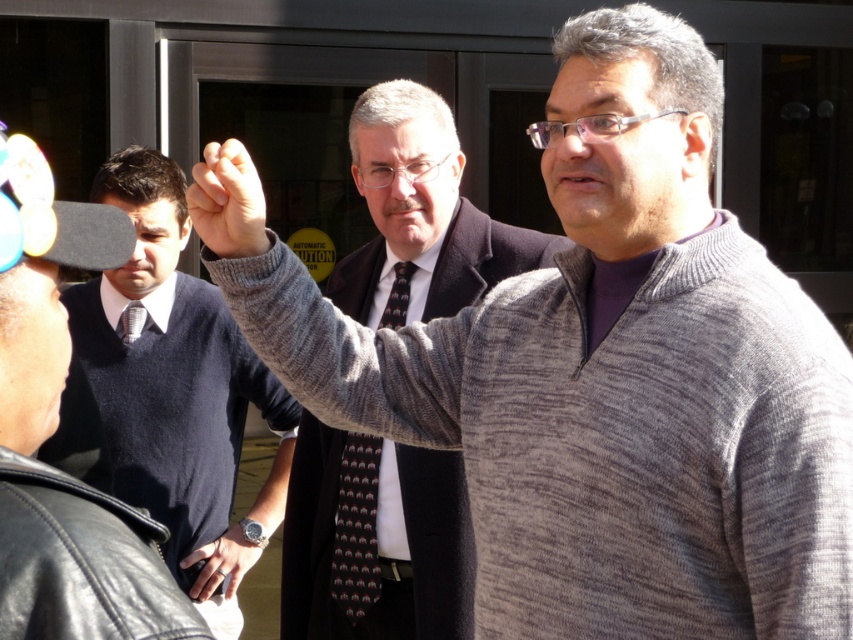
Question: Does black leather watch at center appear on the left side of black dotted tie at center?

Choices:
 (A) no
 (B) yes

Answer: (A)

Question: Which point is closer to the camera?

Choices:
 (A) black dotted tie at center
 (B) gray woolen sweater at center
 (C) knit gray sweater at center
 (D) dark blue sweater at center

Answer: (B)

Question: Which object appears closest to the camera in this image?

Choices:
 (A) black dotted tie at center
 (B) dark gray textured tie at center
 (C) dark blue sweater at center
 (D) knit gray sweater at center

Answer: (B)

Question: Is dark gray textured tie at center to the left of gray woolen sweater at center from the viewer's perspective?

Choices:
 (A) yes
 (B) no

Answer: (B)

Question: Does dark blue sweater at center have a lesser width compared to black leather watch at center?

Choices:
 (A) no
 (B) yes

Answer: (A)

Question: Which object appears closest to the camera in this image?

Choices:
 (A) gray woolen sweater at center
 (B) knit gray sweater at center
 (C) black leather watch at center
 (D) dark blue sweater at center

Answer: (A)